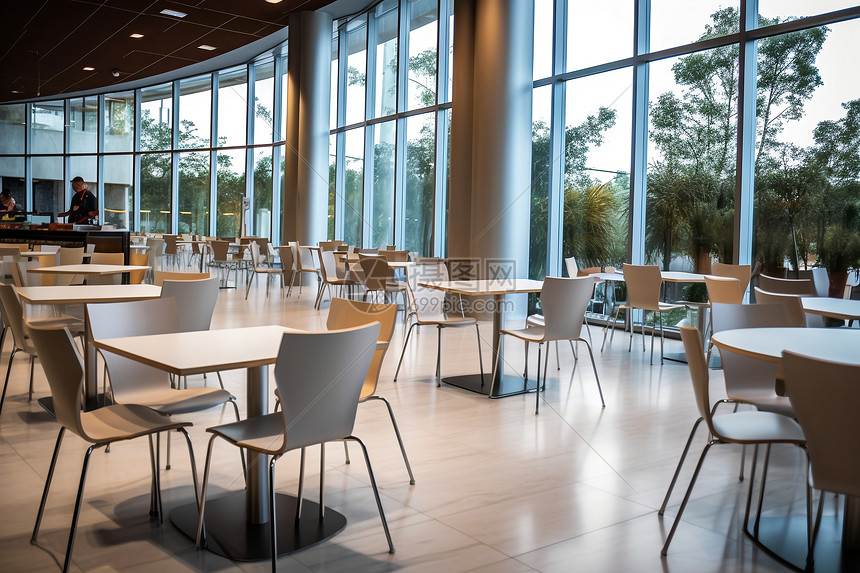
The image size is (860, 573). What are the coordinates of `columns` in the screenshot? It's located at (499, 219), (458, 204), (308, 183), (286, 168).